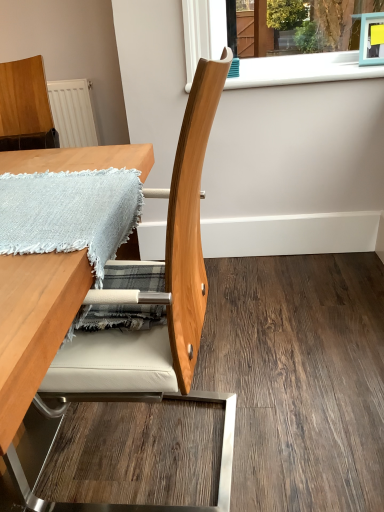
Locate an element on the screen. This screenshot has width=384, height=512. blank space above natural wood chair at center (from a real-world perspective) is located at coordinates (296, 331).